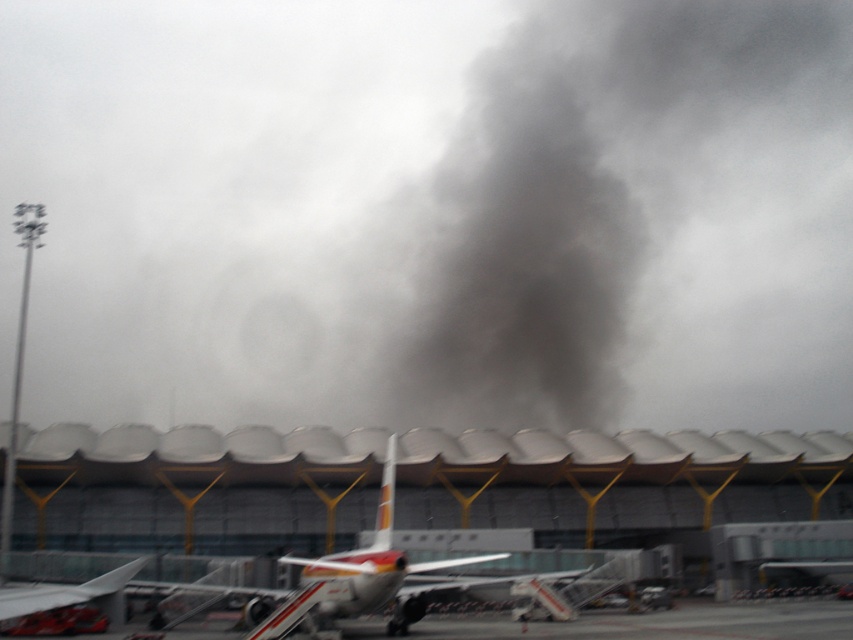
Question: Is black smoke at upper center wider than dark gray smoke at center?

Choices:
 (A) no
 (B) yes

Answer: (B)

Question: Which object appears closest to the camera in this image?

Choices:
 (A) dark gray smoke at center
 (B) black smoke at upper center

Answer: (B)

Question: Can you confirm if black smoke at upper center is smaller than metallic silver airplane at center?

Choices:
 (A) no
 (B) yes

Answer: (A)

Question: Which object appears closest to the camera in this image?

Choices:
 (A) black smoke at upper center
 (B) dark gray smoke at center
 (C) metallic silver airplane at center

Answer: (C)

Question: Is black smoke at upper center to the right of dark gray smoke at center from the viewer's perspective?

Choices:
 (A) no
 (B) yes

Answer: (A)

Question: Based on their relative distances, which object is nearer to the dark gray smoke at center?

Choices:
 (A) metallic silver airplane at center
 (B) black smoke at upper center

Answer: (B)